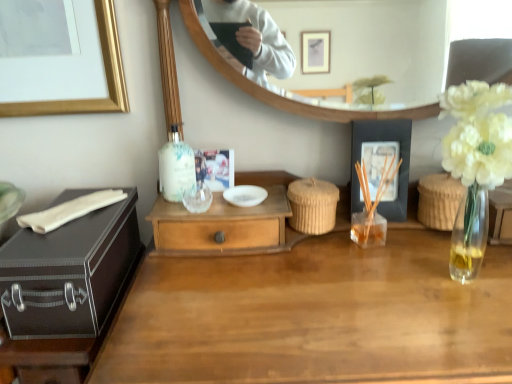
Question: Considering the relative positions of matte black suitcase at left and white glossy bowl at center in the image provided, is matte black suitcase at left to the left of white glossy bowl at center from the viewer's perspective?

Choices:
 (A) no
 (B) yes

Answer: (B)

Question: Would you say white glossy bowl at center is part of matte black suitcase at left's contents?

Choices:
 (A) yes
 (B) no

Answer: (B)

Question: From the image's perspective, would you say matte black suitcase at left is shown under white glossy bowl at center?

Choices:
 (A) yes
 (B) no

Answer: (A)

Question: Is matte black suitcase at left shorter than white glossy bowl at center?

Choices:
 (A) no
 (B) yes

Answer: (A)

Question: Does matte black suitcase at left have a greater height compared to white glossy bowl at center?

Choices:
 (A) yes
 (B) no

Answer: (A)

Question: In terms of height, does transparent glass wine glass at center look taller or shorter compared to black matte picture frame at right?

Choices:
 (A) tall
 (B) short

Answer: (B)

Question: Do you think transparent glass wine glass at center is within black matte picture frame at right, or outside of it?

Choices:
 (A) outside
 (B) inside

Answer: (A)

Question: Looking at the image, does transparent glass wine glass at center seem bigger or smaller compared to black matte picture frame at right?

Choices:
 (A) small
 (B) big

Answer: (A)

Question: Does point (198, 190) appear closer or farther from the camera than point (394, 215)?

Choices:
 (A) farther
 (B) closer

Answer: (B)

Question: From a real-world perspective, is matte black suitcase at left physically located above or below transparent glass wine glass at center?

Choices:
 (A) above
 (B) below

Answer: (B)

Question: From the image's perspective, is matte black suitcase at left positioned above or below transparent glass wine glass at center?

Choices:
 (A) below
 (B) above

Answer: (A)

Question: Is matte black suitcase at left wider or thinner than transparent glass wine glass at center?

Choices:
 (A) wide
 (B) thin

Answer: (A)

Question: Looking at the image, does matte black suitcase at left seem bigger or smaller compared to transparent glass wine glass at center?

Choices:
 (A) big
 (B) small

Answer: (A)

Question: From a real-world perspective, relative to wooden desk at center, is black matte picture frame at right vertically above or below?

Choices:
 (A) above
 (B) below

Answer: (A)

Question: Is black matte picture frame at right situated inside wooden desk at center or outside?

Choices:
 (A) inside
 (B) outside

Answer: (B)